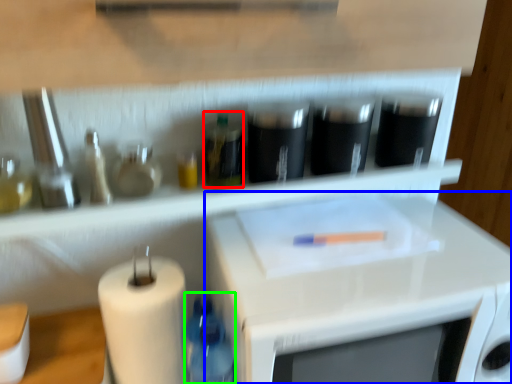
Question: Which is farther away from bottle (highlighted by a red box)? microwave (highlighted by a blue box) or bottle (highlighted by a green box)?

Choices:
 (A) microwave
 (B) bottle

Answer: (A)